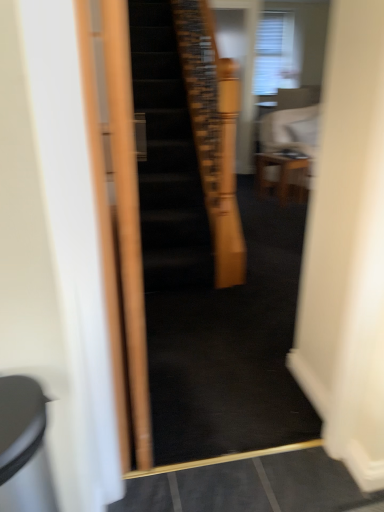
This screenshot has height=512, width=384. What do you see at coordinates (23, 447) in the screenshot? I see `white glossy table at lower left` at bounding box center [23, 447].

Image resolution: width=384 pixels, height=512 pixels. I want to click on white glossy table at lower left, so click(x=23, y=447).

The height and width of the screenshot is (512, 384). I want to click on white glossy table at lower left, so click(x=23, y=447).